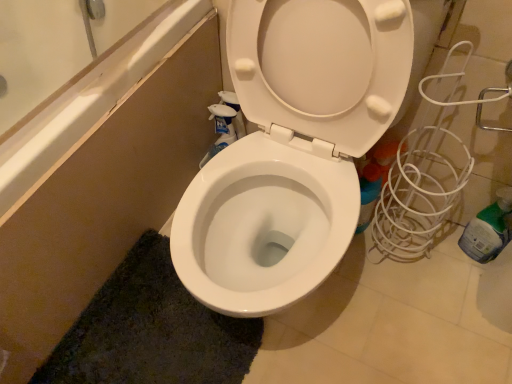
Question: From the image's perspective, would you say dark green shaggy bath mat at lower left is shown under green plastic bottle at right?

Choices:
 (A) no
 (B) yes

Answer: (B)

Question: Considering the relative sizes of dark green shaggy bath mat at lower left and green plastic bottle at right in the image provided, is dark green shaggy bath mat at lower left thinner than green plastic bottle at right?

Choices:
 (A) yes
 (B) no

Answer: (B)

Question: From a real-world perspective, is dark green shaggy bath mat at lower left physically above green plastic bottle at right?

Choices:
 (A) yes
 (B) no

Answer: (B)

Question: Are dark green shaggy bath mat at lower left and green plastic bottle at right located far from each other?

Choices:
 (A) yes
 (B) no

Answer: (B)

Question: Is dark green shaggy bath mat at lower left at the right side of green plastic bottle at right?

Choices:
 (A) no
 (B) yes

Answer: (A)

Question: From a real-world perspective, is dark green shaggy bath mat at lower left under green plastic bottle at right?

Choices:
 (A) no
 (B) yes

Answer: (B)

Question: From a real-world perspective, is green plastic bottle at right located beneath dark green shaggy bath mat at lower left?

Choices:
 (A) no
 (B) yes

Answer: (A)

Question: Is green plastic bottle at right bigger than dark green shaggy bath mat at lower left?

Choices:
 (A) yes
 (B) no

Answer: (B)

Question: Would you say green plastic bottle at right is outside dark green shaggy bath mat at lower left?

Choices:
 (A) no
 (B) yes

Answer: (B)

Question: Does green plastic bottle at right have a smaller size compared to dark green shaggy bath mat at lower left?

Choices:
 (A) no
 (B) yes

Answer: (B)

Question: Could you tell me if green plastic bottle at right is turned towards dark green shaggy bath mat at lower left?

Choices:
 (A) yes
 (B) no

Answer: (B)

Question: From the image's perspective, is green plastic bottle at right below dark green shaggy bath mat at lower left?

Choices:
 (A) yes
 (B) no

Answer: (B)

Question: Considering the positions of green plastic bottle at right and dark green shaggy bath mat at lower left in the image, is green plastic bottle at right wider or thinner than dark green shaggy bath mat at lower left?

Choices:
 (A) wide
 (B) thin

Answer: (B)